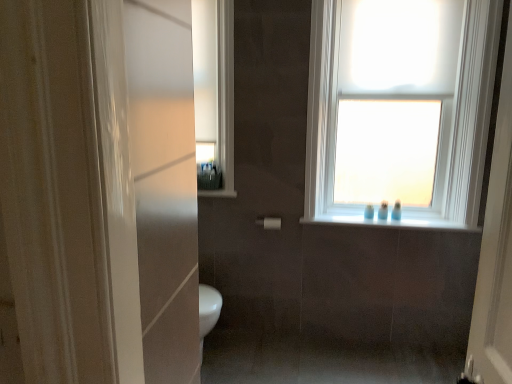
Question: Is white glossy window sill at upper center, marked as the 1th window sill in a left-to-right arrangement, shorter than white glossy window sill at upper center, the 1th window sill from the right?

Choices:
 (A) no
 (B) yes

Answer: (A)

Question: From the image's perspective, is white glossy window sill at upper center, marked as the 1th window sill in a top-to-bottom arrangement, over white glossy window sill at upper center, which is the second window sill from left to right?

Choices:
 (A) yes
 (B) no

Answer: (A)

Question: From a real-world perspective, is white glossy window sill at upper center, marked as the 1th window sill in a top-to-bottom arrangement, below white glossy window sill at upper center, which appears as the second window sill when viewed from the top?

Choices:
 (A) no
 (B) yes

Answer: (A)

Question: From a real-world perspective, is white glossy window sill at upper center, marked as the 1th window sill in a top-to-bottom arrangement, on top of white glossy window sill at upper center, which appears as the second window sill when viewed from the top?

Choices:
 (A) no
 (B) yes

Answer: (B)

Question: Is white glossy window sill at upper center, acting as the second window sill starting from the right, outside of white glossy window sill at upper center, which is the second window sill from left to right?

Choices:
 (A) no
 (B) yes

Answer: (B)

Question: Is white glossy window sill at upper center, the 1th window sill from the right, situated inside blue plastic bottle at upper right, which is counted as the 2th toiletry, starting from the left, or outside?

Choices:
 (A) outside
 (B) inside

Answer: (A)

Question: In terms of size, does white glossy window sill at upper center, which is the second window sill from left to right, appear bigger or smaller than blue plastic bottle at upper right, which is counted as the 2th toiletry, starting from the left?

Choices:
 (A) small
 (B) big

Answer: (B)

Question: From a real-world perspective, relative to blue plastic bottle at upper right, which is counted as the 2th toiletry, starting from the left, is white glossy window sill at upper center, the 1th window sill from the right, vertically above or below?

Choices:
 (A) below
 (B) above

Answer: (A)

Question: In terms of width, does white glossy window sill at upper center, which appears as the second window sill when viewed from the top, look wider or thinner when compared to blue plastic bottle at upper right, the 3th toiletry in the right-to-left sequence?

Choices:
 (A) wide
 (B) thin

Answer: (A)

Question: Is white glossy window sill at upper center, which appears as the second window sill when viewed from the top, wider or thinner than white glossy medicine cabinet at upper left?

Choices:
 (A) wide
 (B) thin

Answer: (A)

Question: Considering their positions, is white glossy window sill at upper center, the first window sill positioned from the bottom, located in front of or behind white glossy medicine cabinet at upper left?

Choices:
 (A) front
 (B) behind

Answer: (B)

Question: Is point (422, 225) positioned closer to the camera than point (197, 160)?

Choices:
 (A) closer
 (B) farther

Answer: (B)

Question: From the image's perspective, is white glossy window sill at upper center, the 1th window sill from the right, above or below white glossy medicine cabinet at upper left?

Choices:
 (A) above
 (B) below

Answer: (B)

Question: Considering the positions of point (226, 190) and point (488, 104), is point (226, 190) closer or farther from the camera than point (488, 104)?

Choices:
 (A) farther
 (B) closer

Answer: (A)

Question: From a real-world perspective, is white glossy window sill at upper center, acting as the second window sill starting from the right, above or below white matte window at upper center?

Choices:
 (A) below
 (B) above

Answer: (A)